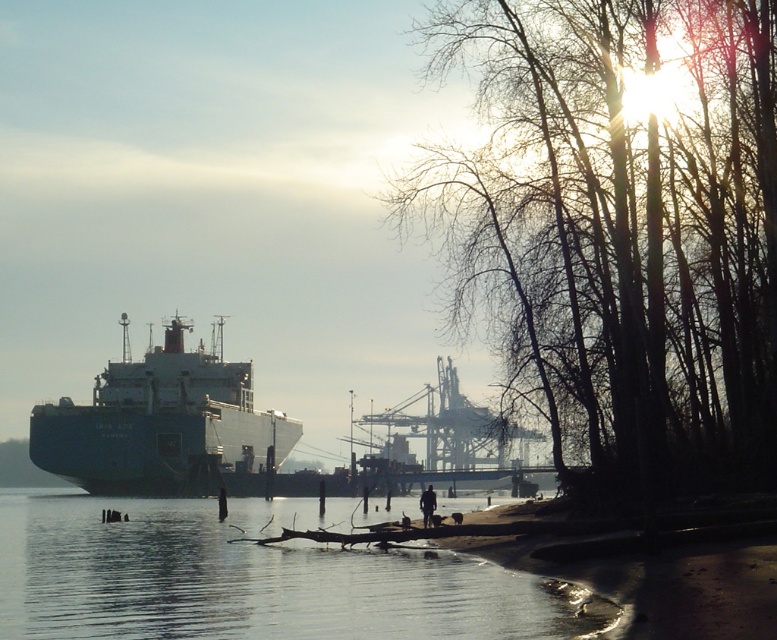
The image size is (777, 640). I want to click on silhouette bare trees at right, so [x=617, y=234].

Which is below, silhouette bare trees at right or smooth water at lower left?

smooth water at lower left is lower down.

Where is `silhouette bare trees at right`? Image resolution: width=777 pixels, height=640 pixels. silhouette bare trees at right is located at coordinates (617, 234).

Who is taller, smooth water at lower left or blue matte cargo ship at left?

blue matte cargo ship at left is taller.

Which is more to the left, smooth water at lower left or blue matte cargo ship at left?

blue matte cargo ship at left is more to the left.

Does point (457, 602) come in front of point (176, 445)?

That is True.

This screenshot has width=777, height=640. I want to click on smooth water at lower left, so click(x=242, y=577).

Can you confirm if silhouette bare trees at right is smaller than dark brown leather jacket at center?

Incorrect, silhouette bare trees at right is not smaller in size than dark brown leather jacket at center.

Is point (518, 163) farther from viewer compared to point (424, 492)?

No, it is in front of (424, 492).

The width and height of the screenshot is (777, 640). What do you see at coordinates (617, 234) in the screenshot?
I see `silhouette bare trees at right` at bounding box center [617, 234].

What are the coordinates of `silhouette bare trees at right` in the screenshot? It's located at (617, 234).